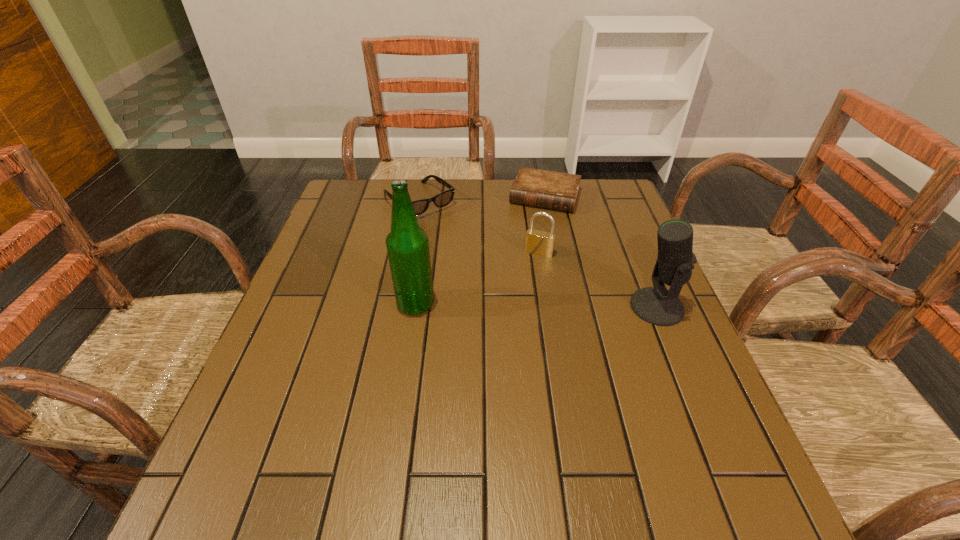
Locate an element on the screen. The width and height of the screenshot is (960, 540). vacant space on the desktop that is between the tallest object and the microphone and is positioned on the spine side of the shortest object is located at coordinates (505, 305).

I want to click on free space on the desktop that is between the tallest object and the rightmost object and is positioned on the lenses of the fourth tallest object, so click(x=528, y=306).

Locate an element on the screen. Image resolution: width=960 pixels, height=540 pixels. vacant space on the desktop that is between the tallest object and the second tallest object and is positioned on the front-facing side of the third nearest object is located at coordinates (517, 306).